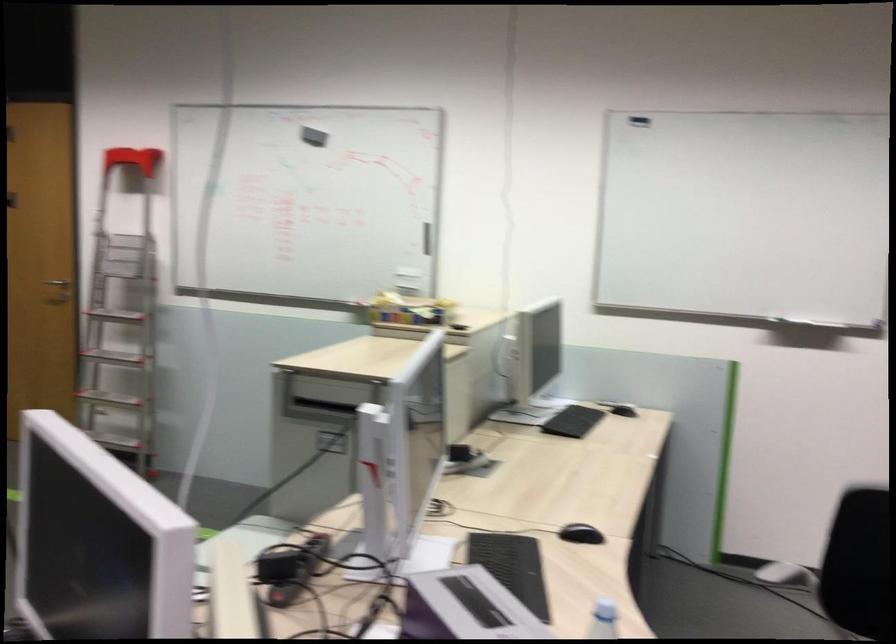
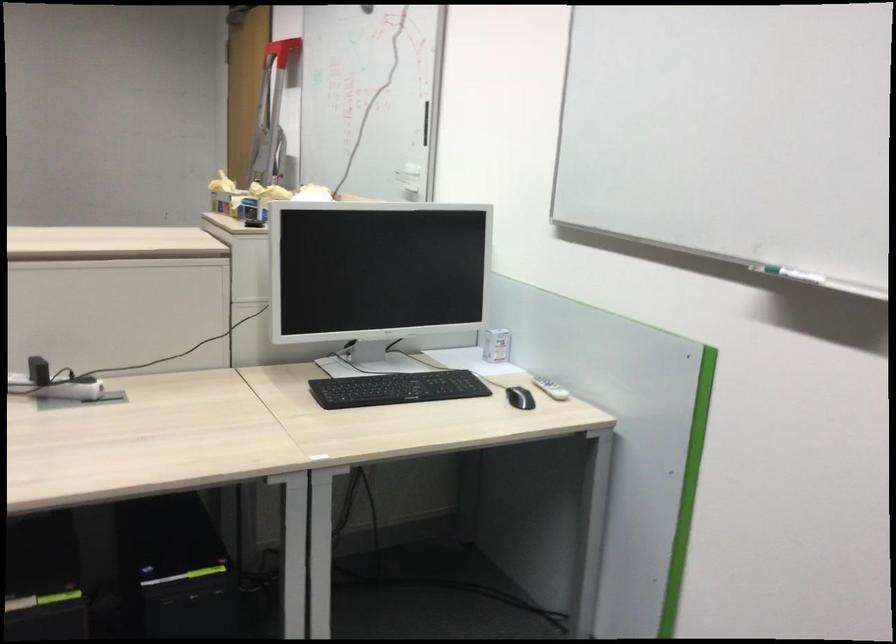
Find the pixel in the second image that matches point (564, 386) in the first image.

(495, 345)